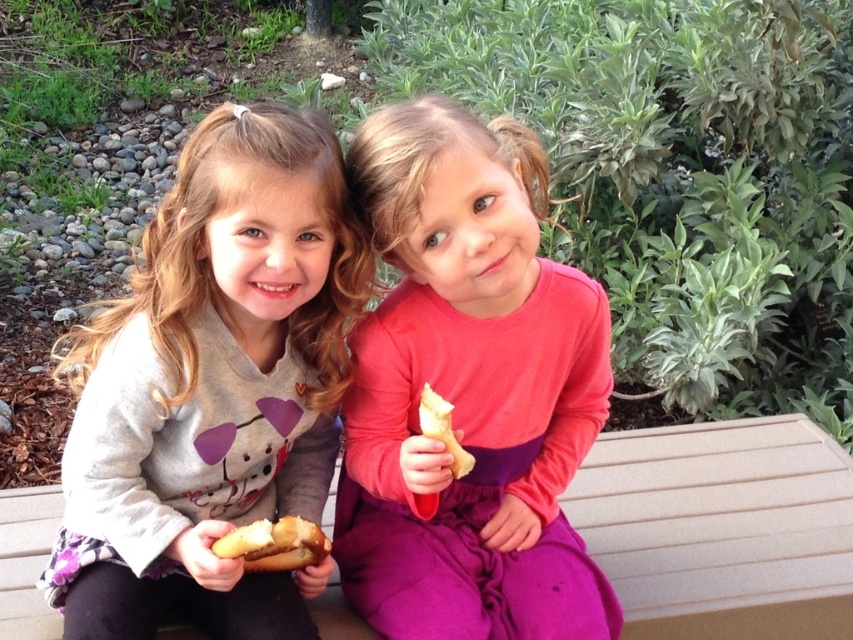
Question: Can you confirm if matte pink dress at center is positioned to the right of bread-like at center?

Choices:
 (A) no
 (B) yes

Answer: (B)

Question: Can you confirm if matte gray sweater at center is positioned to the left of yellowish bread at center?

Choices:
 (A) no
 (B) yes

Answer: (B)

Question: Among these objects, which one is farthest from the camera?

Choices:
 (A) yellowish bread at center
 (B) matte pink dress at center
 (C) matte gray sweater at center
 (D) bread-like at center

Answer: (A)

Question: Among these points, which one is nearest to the camera?

Choices:
 (A) (274, 566)
 (B) (428, 406)

Answer: (B)

Question: Which of the following is the farthest from the observer?

Choices:
 (A) (433, 428)
 (B) (173, 257)

Answer: (B)

Question: Does matte gray sweater at center appear over matte pink dress at center?

Choices:
 (A) yes
 (B) no

Answer: (A)